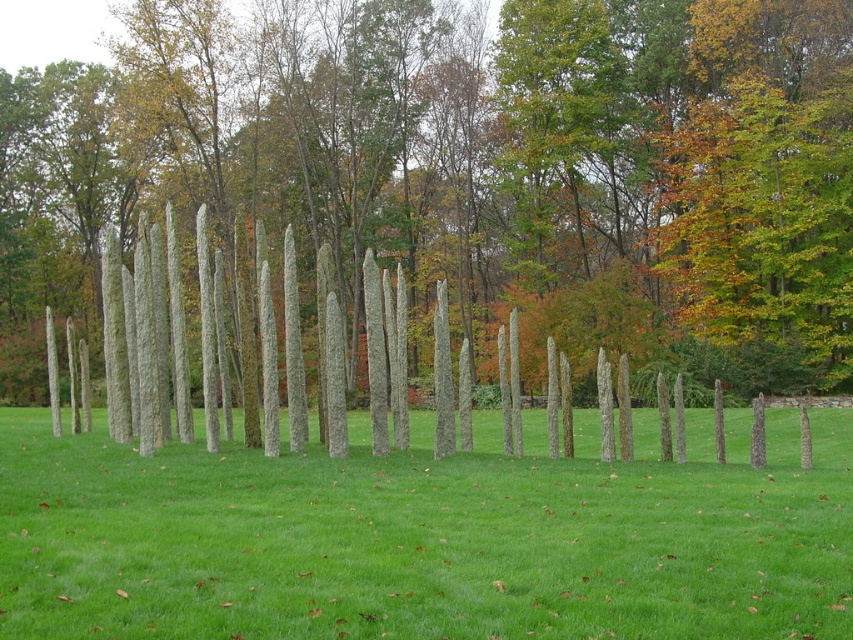
Question: Can you confirm if smooth gray pole at center is positioned below green grass at center?

Choices:
 (A) yes
 (B) no

Answer: (B)

Question: Which point is farther from the camera taking this photo?

Choices:
 (A) (239, 515)
 (B) (758, 241)

Answer: (B)

Question: Does smooth gray pole at center have a greater width compared to green grass at center?

Choices:
 (A) no
 (B) yes

Answer: (B)

Question: Considering the relative positions of smooth gray pole at center and green grass at center in the image provided, where is smooth gray pole at center located with respect to green grass at center?

Choices:
 (A) left
 (B) right

Answer: (A)

Question: Which point is farther to the camera?

Choices:
 (A) (569, 508)
 (B) (425, 134)

Answer: (B)